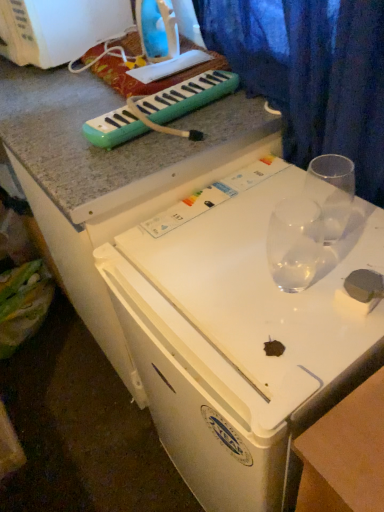
This screenshot has height=512, width=384. In order to click on vacant space behind transparent glass at upper right, the 2th martini glass viewed from the left in this screenshot , I will do `click(300, 195)`.